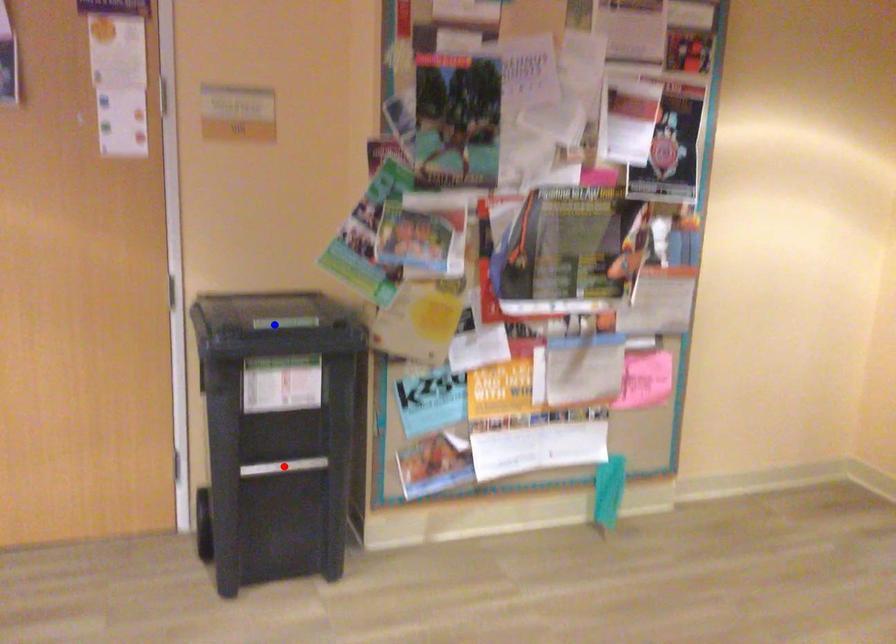
Question: Two points are marked on the image. Which point is closer to the camera?

Choices:
 (A) Blue point is closer.
 (B) Red point is closer.

Answer: (A)